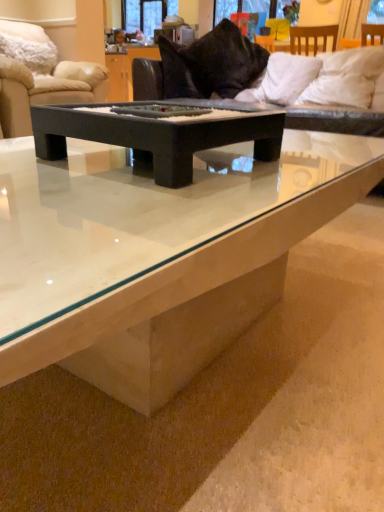
Question: Is white soft pillow at upper right, which appears as the first pillow when viewed from the right, taller than black matte tray at center, the 2th coffee table in the bottom-to-top sequence?

Choices:
 (A) no
 (B) yes

Answer: (B)

Question: Would you say black matte tray at center, the 2th coffee table in the bottom-to-top sequence, is part of white soft pillow at upper right, which appears as the first pillow when viewed from the right,'s contents?

Choices:
 (A) no
 (B) yes

Answer: (A)

Question: Is the surface of white soft pillow at upper right, which ranks as the fourth pillow in left-to-right order, in direct contact with black matte tray at center, the 2th coffee table in the bottom-to-top sequence?

Choices:
 (A) no
 (B) yes

Answer: (A)

Question: Does white soft pillow at upper right, which appears as the first pillow when viewed from the right, appear on the right side of black matte tray at center, the 2th coffee table in the bottom-to-top sequence?

Choices:
 (A) no
 (B) yes

Answer: (B)

Question: Can you confirm if white soft pillow at upper right, which ranks as the fourth pillow in left-to-right order, is shorter than black matte tray at center, the 1th coffee table positioned from the top?

Choices:
 (A) no
 (B) yes

Answer: (A)

Question: From a real-world perspective, is black velvet pillow at upper center, the second pillow in the left-to-right sequence, physically located above or below beige fabric couch at upper left, which is the 2th studio couch from right to left?

Choices:
 (A) above
 (B) below

Answer: (A)

Question: Considering the positions of black velvet pillow at upper center, marked as the third pillow in a right-to-left arrangement, and beige fabric couch at upper left, which is the 2th studio couch from right to left, in the image, is black velvet pillow at upper center, marked as the third pillow in a right-to-left arrangement, taller or shorter than beige fabric couch at upper left, which is the 2th studio couch from right to left,?

Choices:
 (A) tall
 (B) short

Answer: (B)

Question: Relative to beige fabric couch at upper left, which is the 2th studio couch from right to left, is black velvet pillow at upper center, marked as the third pillow in a right-to-left arrangement, in front or behind?

Choices:
 (A) behind
 (B) front

Answer: (B)

Question: Which is correct: black velvet pillow at upper center, the second pillow in the left-to-right sequence, is inside beige fabric couch at upper left, which is counted as the 1th studio couch, starting from the left, or outside of it?

Choices:
 (A) inside
 (B) outside

Answer: (B)

Question: From the image's perspective, relative to transparent glass window screen at upper center, which is the second window screen in front-to-back order, is black velvet pillow at upper center, marked as the third pillow in a right-to-left arrangement, above or below?

Choices:
 (A) below
 (B) above

Answer: (A)

Question: Is black velvet pillow at upper center, the second pillow in the left-to-right sequence, wider or thinner than transparent glass window screen at upper center, placed as the 1th window screen when sorted from back to front?

Choices:
 (A) thin
 (B) wide

Answer: (B)

Question: Does point (208, 73) appear closer or farther from the camera than point (147, 15)?

Choices:
 (A) closer
 (B) farther

Answer: (A)

Question: Is black velvet pillow at upper center, the second pillow in the left-to-right sequence, to the left or to the right of transparent glass window screen at upper center, arranged as the second window screen when viewed from the right, in the image?

Choices:
 (A) left
 (B) right

Answer: (B)

Question: From their relative heights in the image, would you say black matte tray at center, the 2th coffee table in the bottom-to-top sequence, is taller or shorter than black velvet pillow at upper center, marked as the third pillow in a right-to-left arrangement?

Choices:
 (A) short
 (B) tall

Answer: (A)

Question: Considering the positions of black matte tray at center, the 2th coffee table in the bottom-to-top sequence, and black velvet pillow at upper center, marked as the third pillow in a right-to-left arrangement, in the image, is black matte tray at center, the 2th coffee table in the bottom-to-top sequence, bigger or smaller than black velvet pillow at upper center, marked as the third pillow in a right-to-left arrangement,?

Choices:
 (A) big
 (B) small

Answer: (B)